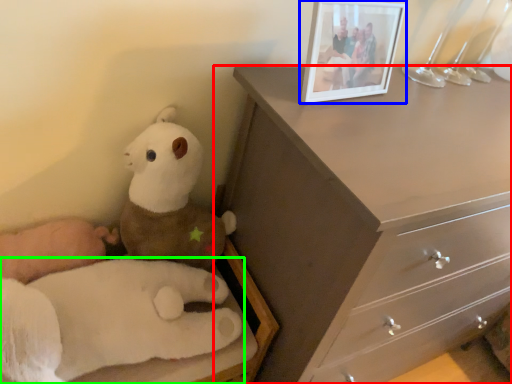
Question: Which is farther away from chest of drawers (highlighted by a red box)? picture frame (highlighted by a blue box) or toy (highlighted by a green box)?

Choices:
 (A) picture frame
 (B) toy

Answer: (B)